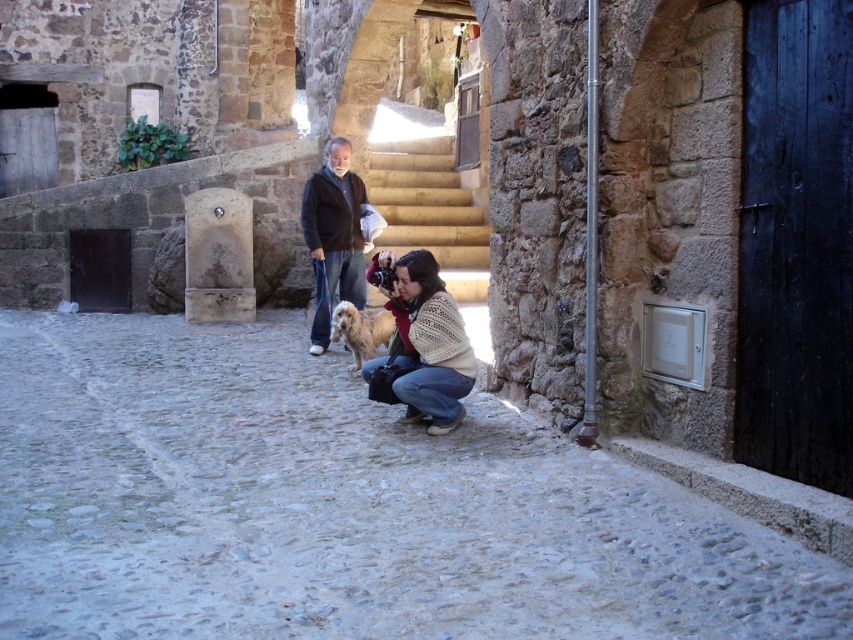
Describe the element at coordinates (341, 506) in the screenshot. I see `smooth stone alley at center` at that location.

Can you confirm if smooth stone alley at center is wider than white knitted sweater at center?

No, smooth stone alley at center is not wider than white knitted sweater at center.

The image size is (853, 640). What do you see at coordinates (341, 506) in the screenshot?
I see `smooth stone alley at center` at bounding box center [341, 506].

Find the location of a particular element. This screenshot has width=853, height=640. smooth stone alley at center is located at coordinates (341, 506).

Does yellow stone stairs at center have a larger size compared to golden fur dog at center?

Indeed, yellow stone stairs at center has a larger size compared to golden fur dog at center.

Between point (431, 161) and point (350, 348), which one is positioned behind?

Positioned behind is point (431, 161).

You are a GUI agent. You are given a task and a screenshot of the screen. Output one action in this format:
    pyautogui.click(x=<x>, y=<y>)
    Task: Click on the yellow stone stairs at center
    
    Given the screenshot: What is the action you would take?
    pyautogui.click(x=426, y=202)

Between smooth stone alley at center and dark brown jacket at center, which one appears on the right side from the viewer's perspective?

dark brown jacket at center

Who is more forward, [694,500] or [347,250]?

Point [694,500] is more forward.

Locate an element on the screen. The height and width of the screenshot is (640, 853). smooth stone alley at center is located at coordinates (341, 506).